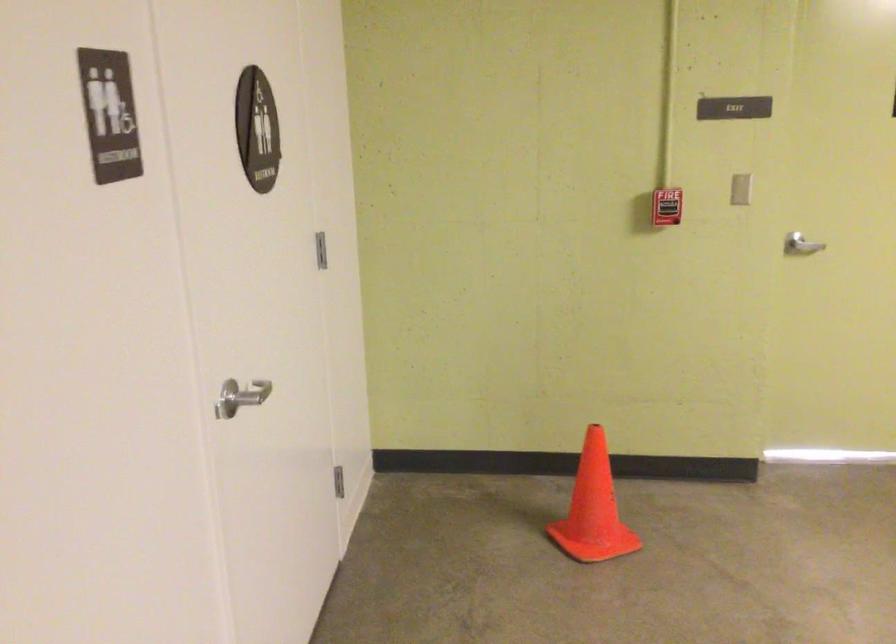
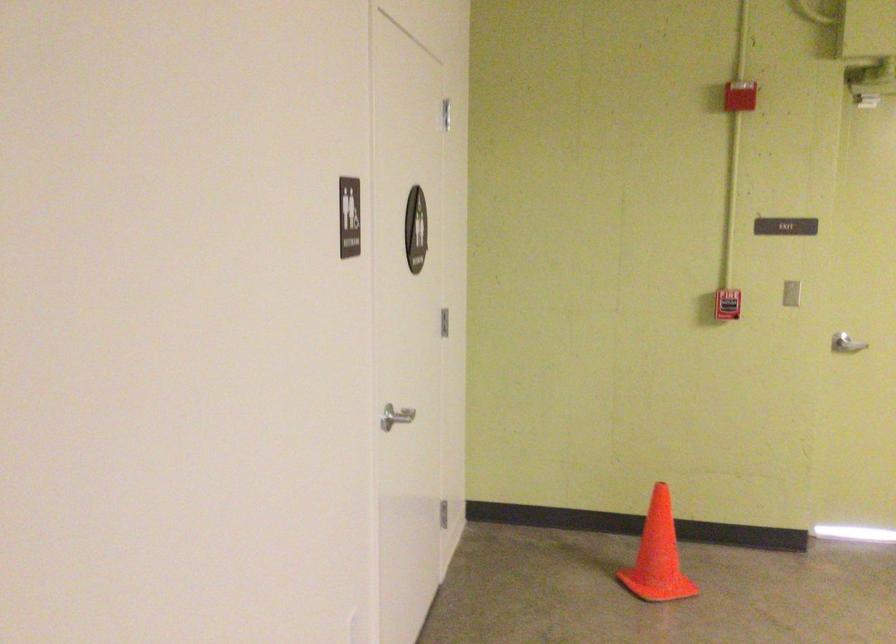
Locate, in the second image, the point that corresponds to (728,196) in the first image.

(790, 292)